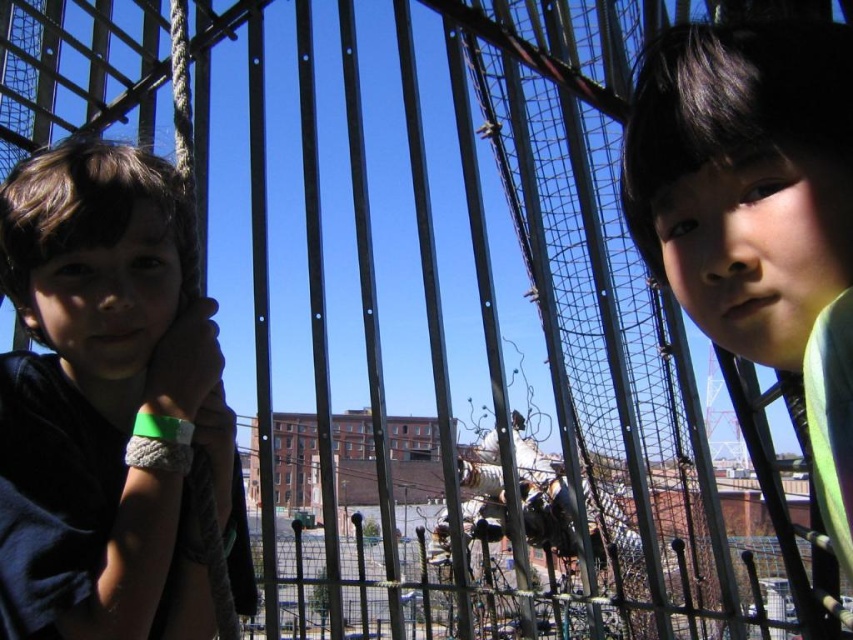
In the scene with the metal structure and urban background, there are two children. One has dark brown hair at left and the other wears a smooth green shirt at right. From the perspective of an observer looking at the image, which child is positioned more to the left side?

The dark brown hair at left is positioned to the left of the smooth green shirt at right, so the child with dark brown hair at left is more to the left.

You are a photographer trying to capture a photo of the dark brown hair at left and the smooth green shirt at right. If you want to ensure both subjects are fully visible in the frame, which subject should you focus on first to account for their size difference?

A: The dark brown hair at left has a greater width than the smooth green shirt at right, so you should focus on the dark brown hair at left first to ensure it fits properly in the frame.